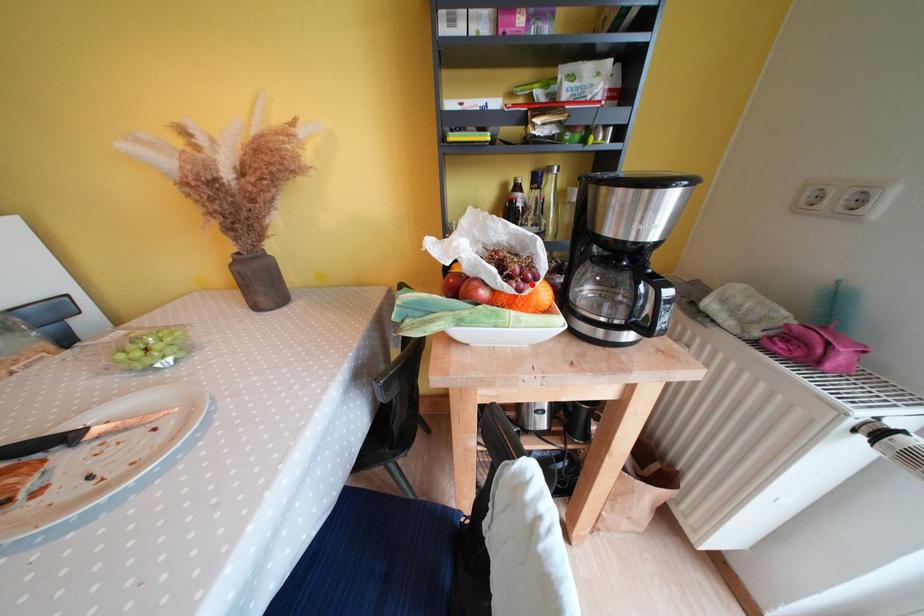
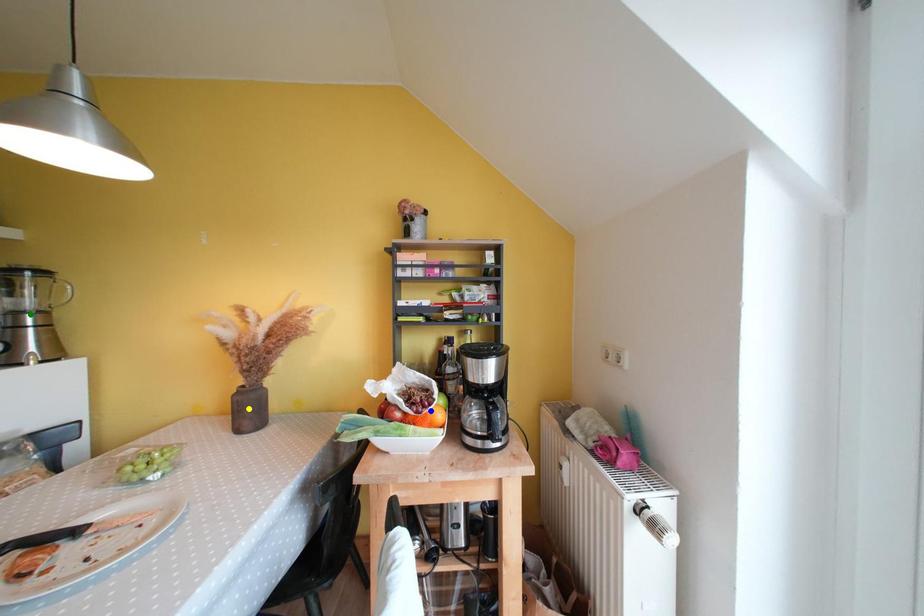
Question: I am providing you with two images of the same scene from different viewpoints. A red point is marked on the first image. You are given multiple points on the second image. Which point in image 2 represents the same 3d spot as the red point in image 1?

Choices:
 (A) blue point
 (B) yellow point
 (C) green point

Answer: (A)